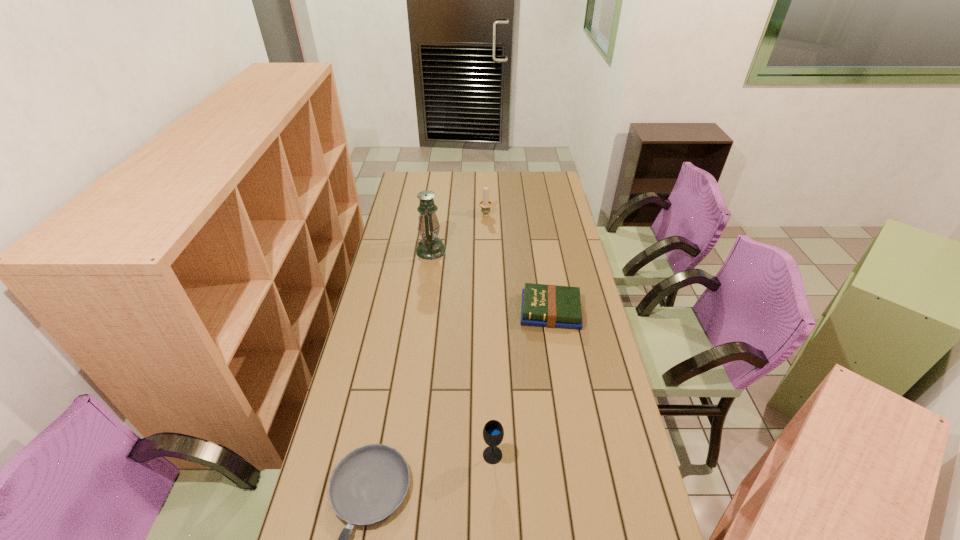
I want to click on free spot between the third nearest object and the tallest object, so click(491, 281).

This screenshot has height=540, width=960. I want to click on empty space between the wineglass and the farthest object, so pyautogui.click(x=490, y=334).

The image size is (960, 540). Find the location of `empty location between the wineglass and the oil lamp`. empty location between the wineglass and the oil lamp is located at coordinates (462, 353).

The image size is (960, 540). Identify the location of blank region between the rightmost object and the wineglass. (521, 383).

Find the location of a particular element. The image size is (960, 540). free space that is in between the farthest object and the wineglass is located at coordinates (490, 334).

Locate an element on the screen. The image size is (960, 540). vacant area between the wineglass and the oil lamp is located at coordinates (462, 353).

What are the coordinates of `object that ranks as the third closest to the candle_holder` in the screenshot? It's located at (493, 432).

You are a GUI agent. You are given a task and a screenshot of the screen. Output one action in this format:
    pyautogui.click(x=<x>, y=<y>)
    Task: Click on the object that is the third closest to the tallest object
    The height and width of the screenshot is (540, 960).
    Given the screenshot: What is the action you would take?
    pyautogui.click(x=369, y=484)